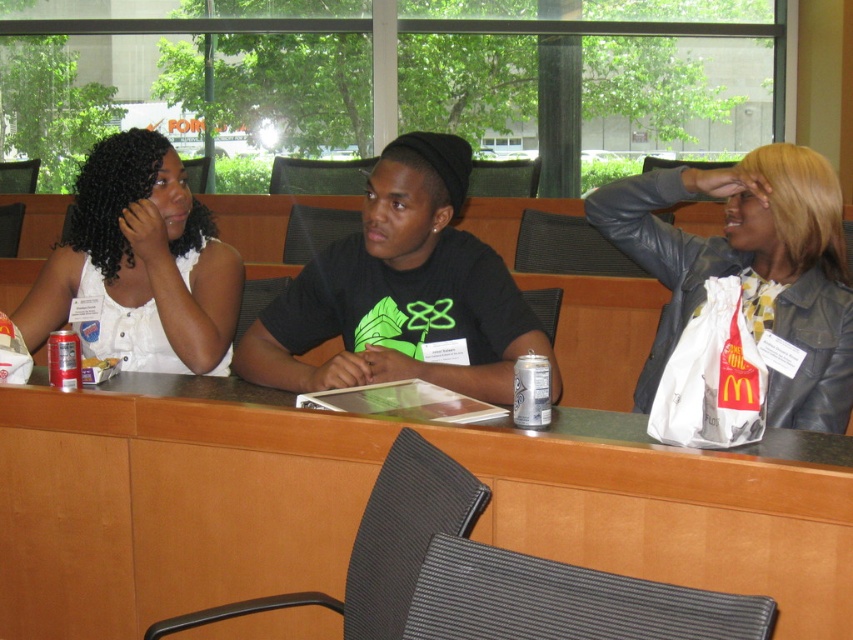
You are a person who is 5 feet tall. You are standing in front of the green matte table at center. Can you comfortably rest your arms on the table without bending over?

The green matte table at center is 4.44 feet away from you. Since the average arm length for a 5 foot tall person is about 2.5 feet, the distance between you and the table is greater than your arm length. Therefore, you would need to take a step forward to reach the table comfortably.

You are a photographer standing to the left of the table. You want to take a photo of both the black matte shirt at center and the white matte shirt at upper left. Which shirt should you focus on first to ensure both are in the frame?

The black matte shirt at center is to the right of the white matte shirt at upper left, so you should focus on the white matte shirt at upper left first to ensure both are in the frame.

You are a person who is 1.8 meters tall. You are standing in the room and see the green matte table at center and the white matte shirt at upper left. Which object is closer to your eye level?

The white matte shirt at upper left is closer to your eye level because it is taller than the green matte table at center.